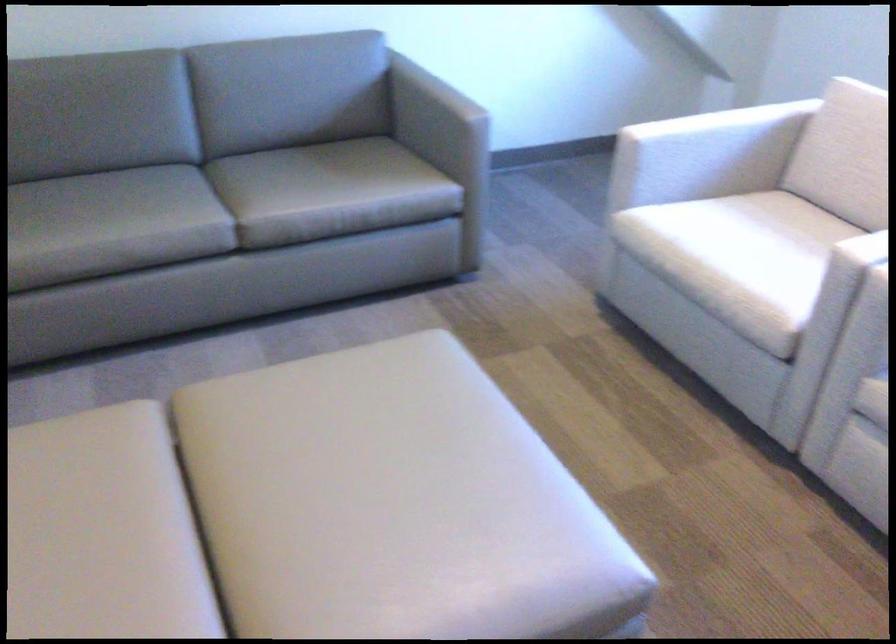
Find where to sit the gray sofa sitting surface. Please return your answer as a coordinate pair (x, y).

(306, 174)